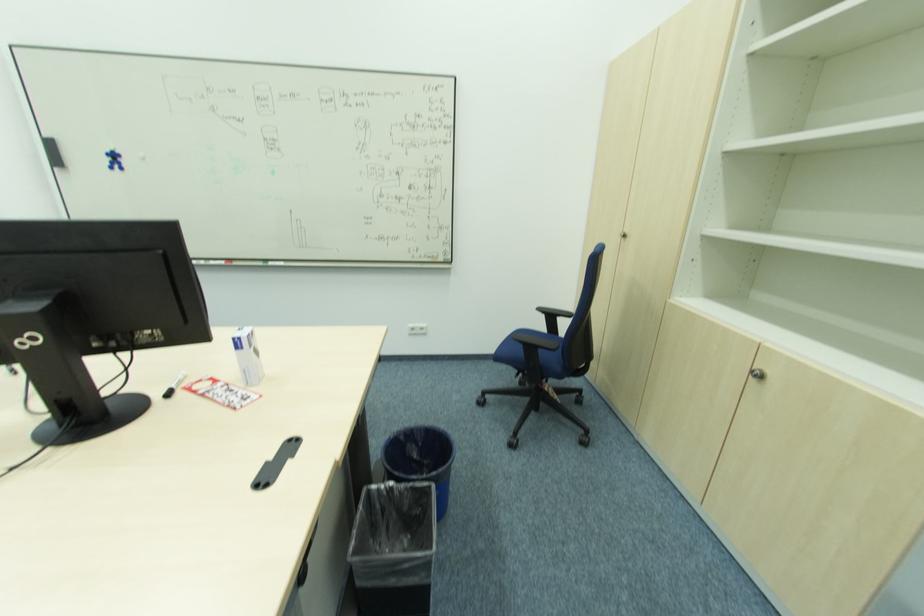
Which object does [248,355] point to?

It refers to a white milk carton.